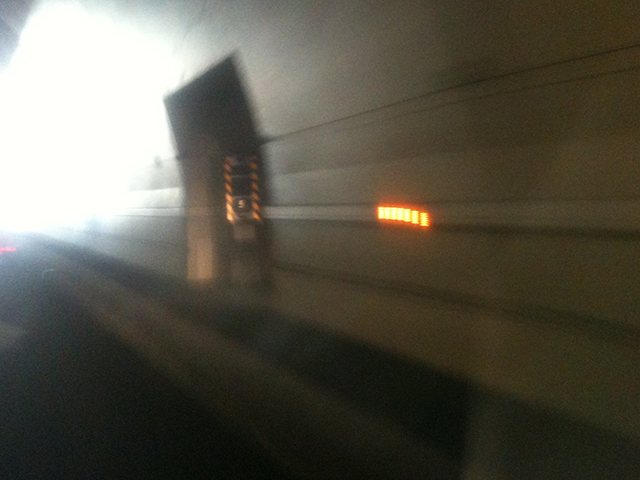
The width and height of the screenshot is (640, 480). I want to click on doorway, so click(194, 162).